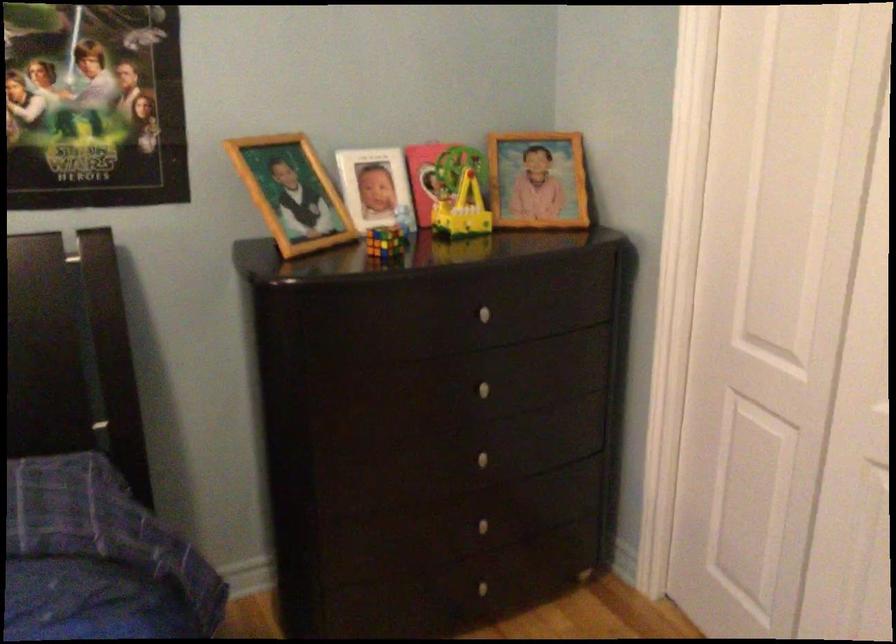
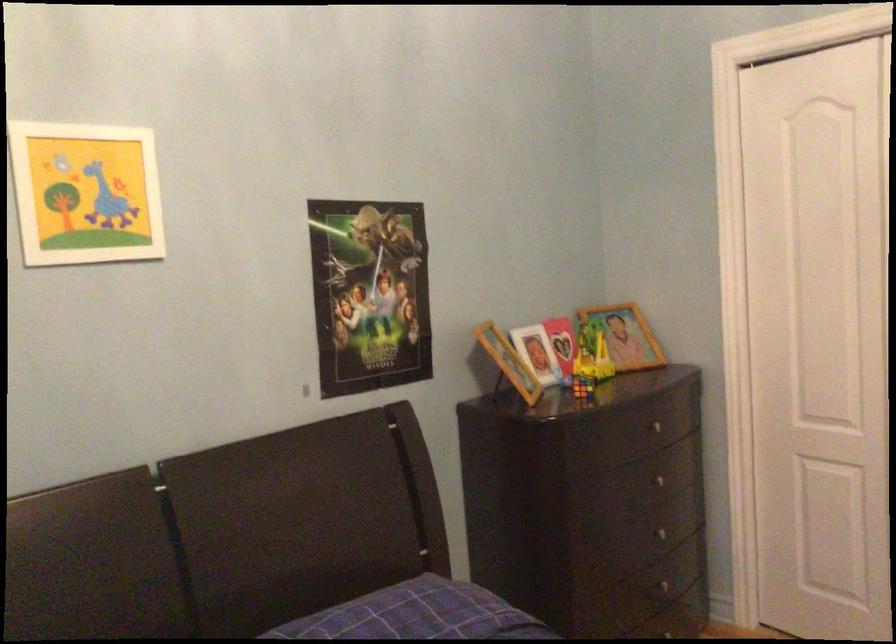
Find the pixel in the second image that matches (x=383, y=240) in the first image.

(582, 386)